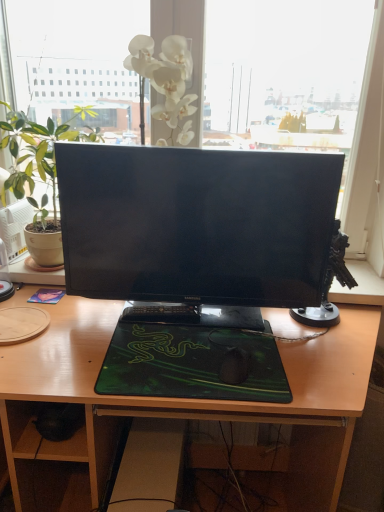
Question: Relative to green matte houseplant at left, is black matte mouse at center in front or behind?

Choices:
 (A) front
 (B) behind

Answer: (A)

Question: From their relative heights in the image, would you say black matte mouse at center is taller or shorter than green matte houseplant at left?

Choices:
 (A) short
 (B) tall

Answer: (A)

Question: Which is nearer to the black matte mouse at center?

Choices:
 (A) black plastic keyboard at center
 (B) green matte mousepad at center
 (C) black glossy monitor at center
 (D) green matte houseplant at left
 (E) wooden desk at center

Answer: (B)

Question: Based on their relative distances, which object is nearer to the wooden desk at center?

Choices:
 (A) green matte houseplant at left
 (B) black glossy monitor at center
 (C) black plastic keyboard at center
 (D) green matte mousepad at center
 (E) black matte mouse at center

Answer: (D)